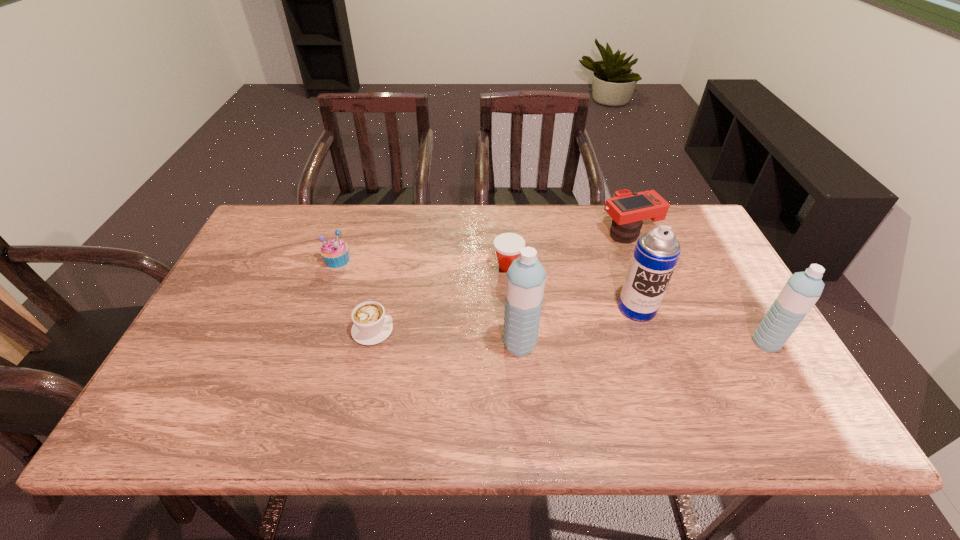
In the current image, all water bottles are evenly spaced. To maintain this equal spacing, where should an additional water bottle be placed on the left? Please point out a free spot. Please provide its 2D coordinates. Your answer should be formatted as a tuple, i.e. [(x, y)], where the tuple contains the x and y coordinates of a point satisfying the conditions above.

[(272, 347)]